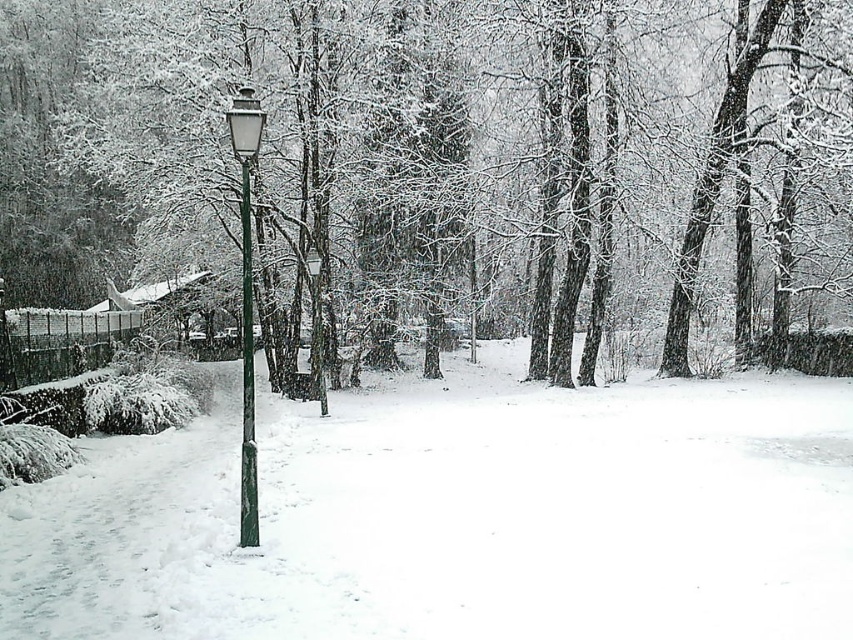
You are a snowplow operator needing to clear the path between the white fluffy snow at center and the green metallic pole at center. If your snowplow is 12 feet wide, can you safely navigate the path between them?

The distance between the white fluffy snow at center and the green metallic pole at center is 18.03 feet. Since the snowplow is 12 feet wide, it can safely navigate the path as the distance is greater than the plow width.

You are a snowplow operator tasked with clearing snow from the path. You notice the white fluffy snow at center and the green metallic pole at center. Which object is shorter in height?

The white fluffy snow at center is shorter in height compared to the green metallic pole at center.

You are a snowplow driver trying to clear the pathway in the winter scene. You need to know the position of the green metallic pole at center relative to the white fluffy snow at center. Which object is on the left side of the other?

The green metallic pole at center is on the left side of the white fluffy snow at center.